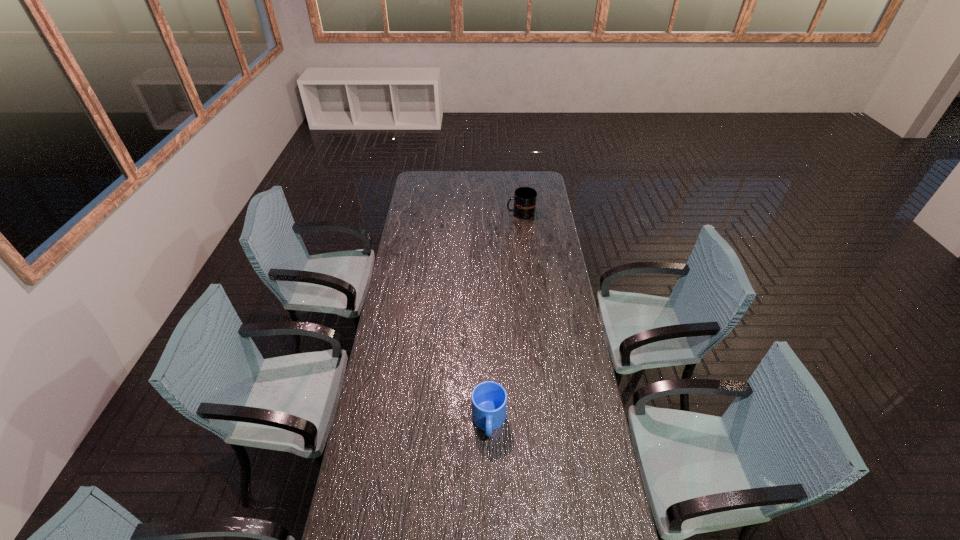
The height and width of the screenshot is (540, 960). I want to click on the right object, so click(525, 198).

This screenshot has width=960, height=540. What are the coordinates of `the farther mug` in the screenshot? It's located at click(525, 198).

At what (x,y) coordinates should I click in order to perform the action: click on the left mug. Please return your answer as a coordinate pair (x, y). This screenshot has height=540, width=960. Looking at the image, I should click on (489, 399).

The height and width of the screenshot is (540, 960). What are the coordinates of `the left object` in the screenshot? It's located at (489, 399).

Where is `blank area located with the handle on the side of the farther mug`? The image size is (960, 540). blank area located with the handle on the side of the farther mug is located at coordinates (494, 213).

Where is `vacant space situated 0.280m with the handle on the side of the farther mug`? The width and height of the screenshot is (960, 540). vacant space situated 0.280m with the handle on the side of the farther mug is located at coordinates (x=459, y=213).

Locate an element on the screen. The width and height of the screenshot is (960, 540). free space located with the handle on the side of the farther mug is located at coordinates (457, 213).

Image resolution: width=960 pixels, height=540 pixels. I want to click on vacant space located 0.250m on the side of the nearer object with the handle, so click(491, 520).

This screenshot has width=960, height=540. I want to click on object that is at the right edge, so click(x=525, y=198).

Where is `free space at the far edge of the desktop`? Image resolution: width=960 pixels, height=540 pixels. free space at the far edge of the desktop is located at coordinates (443, 172).